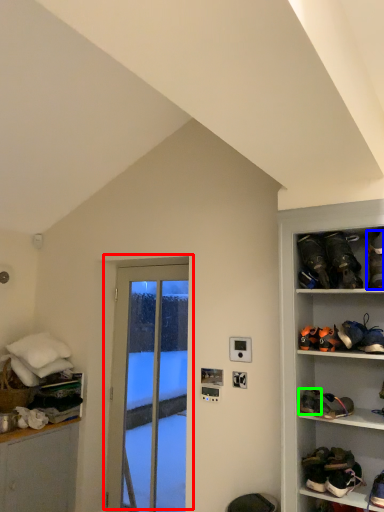
Question: Which is nearer to the door (highlighted by a red box)? footwear (highlighted by a blue box) or footwear (highlighted by a green box).

Choices:
 (A) footwear
 (B) footwear

Answer: (B)